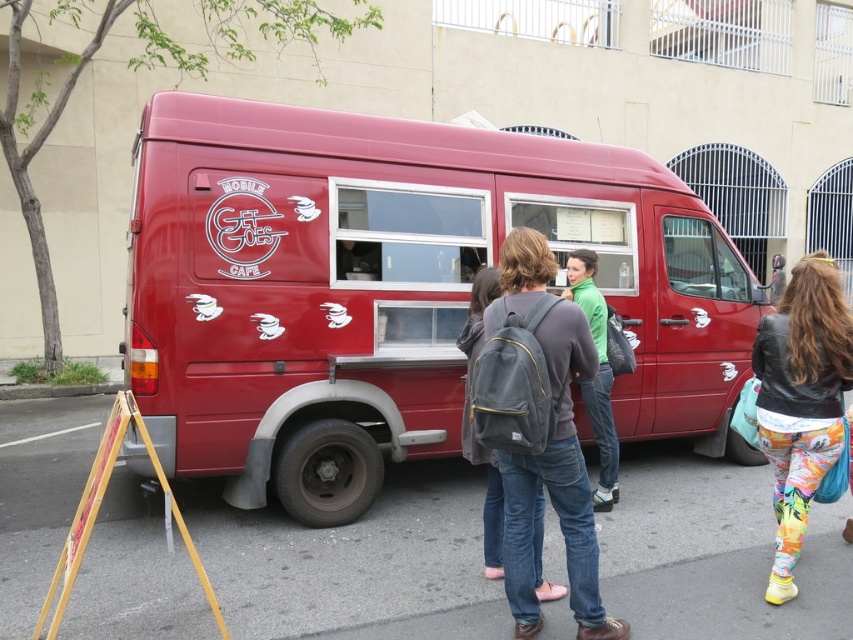
You are a customer waiting in line at the mobile cafe van. You notice the matte red van at center and the denim jeans at center. Which object is positioned higher in the image?

The matte red van at center is positioned higher than the denim jeans at center in the image.